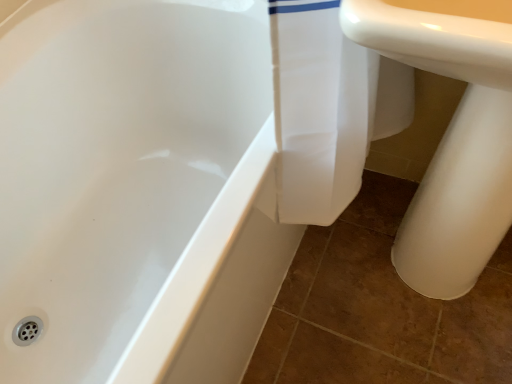
This screenshot has width=512, height=384. What do you see at coordinates (450, 142) in the screenshot?
I see `white glossy sink at lower right` at bounding box center [450, 142].

Locate an element on the screen. white glossy sink at lower right is located at coordinates (450, 142).

At what (x,y) coordinates should I click in order to perform the action: click on white glossy sink at lower right. Please return your answer as a coordinate pair (x, y). This screenshot has width=512, height=384. Looking at the image, I should click on (450, 142).